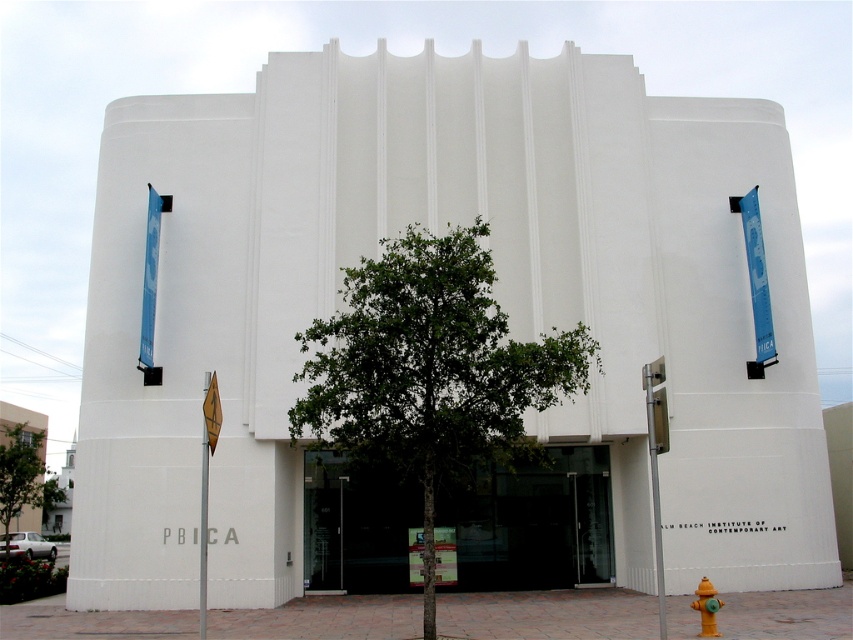
Question: Is transparent glass doors at center thinner than green leafy tree at left?

Choices:
 (A) yes
 (B) no

Answer: (A)

Question: Can you confirm if green leafy tree at left is smaller than yellow matte hydrant at lower right?

Choices:
 (A) yes
 (B) no

Answer: (B)

Question: Estimate the real-world distances between objects in this image. Which object is farther from the transparent glass doors at center?

Choices:
 (A) yellow matte hydrant at lower right
 (B) green leafy tree at center

Answer: (B)

Question: Which point is closer to the camera?

Choices:
 (A) click(x=433, y=404)
 (B) click(x=1, y=496)
 (C) click(x=550, y=564)
 (D) click(x=717, y=634)

Answer: (A)

Question: Among these objects, which one is nearest to the camera?

Choices:
 (A) green leafy tree at left
 (B) transparent glass doors at center

Answer: (B)

Question: Observing the image, what is the correct spatial positioning of transparent glass doors at center in reference to green leafy tree at left?

Choices:
 (A) left
 (B) right

Answer: (B)